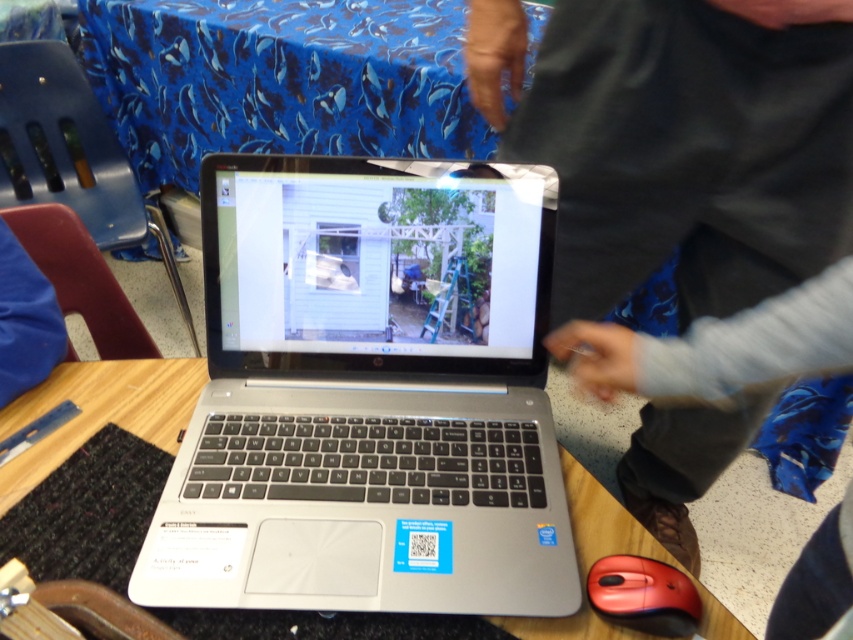
Between blue fabric tablecloth at upper center and gray fabric at upper center, which one has more height?

Standing taller between the two is blue fabric tablecloth at upper center.

Does blue fabric tablecloth at upper center appear under gray fabric at upper center?

Actually, blue fabric tablecloth at upper center is above gray fabric at upper center.

Find the location of a particular element. The height and width of the screenshot is (640, 853). blue fabric tablecloth at upper center is located at coordinates (279, 80).

I want to click on blue fabric tablecloth at upper center, so tap(279, 80).

Is silver metallic laptop at center above gray fabric at upper center?

Indeed, silver metallic laptop at center is positioned over gray fabric at upper center.

The width and height of the screenshot is (853, 640). I want to click on silver metallic laptop at center, so (x=367, y=397).

Which is more to the left, silver metallic laptop at center or wooden table at center?

wooden table at center

Is silver metallic laptop at center taller than wooden table at center?

Yes.

What do you see at coordinates (367, 397) in the screenshot? This screenshot has height=640, width=853. I see `silver metallic laptop at center` at bounding box center [367, 397].

At what (x,y) coordinates should I click in order to perform the action: click on silver metallic laptop at center. Please return your answer as a coordinate pair (x, y). This screenshot has height=640, width=853. Looking at the image, I should click on (367, 397).